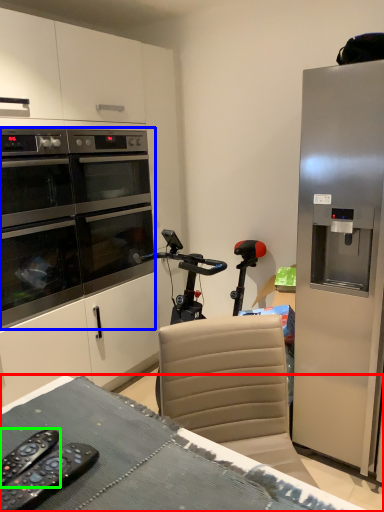
Question: Which object is the closest to the desk (highlighted by a red box)? Choose among these: home appliance (highlighted by a blue box) or remote control (highlighted by a green box).

Choices:
 (A) home appliance
 (B) remote control

Answer: (B)